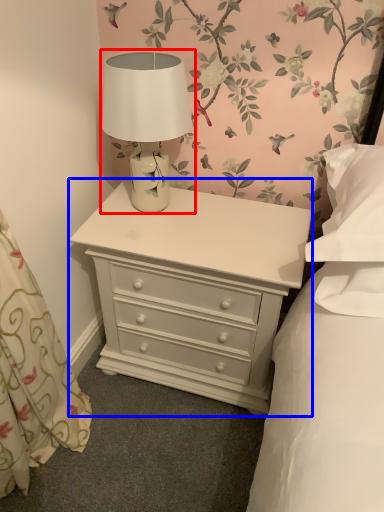
Question: Which object is closer to the camera taking this photo, table lamp (highlighted by a red box) or nightstand (highlighted by a blue box)?

Choices:
 (A) table lamp
 (B) nightstand

Answer: (A)